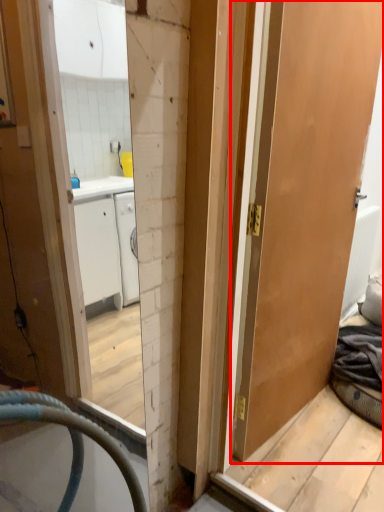
Question: From the image's perspective, where is door (annotated by the red box) located in relation to radiator in the image?

Choices:
 (A) above
 (B) below

Answer: (A)